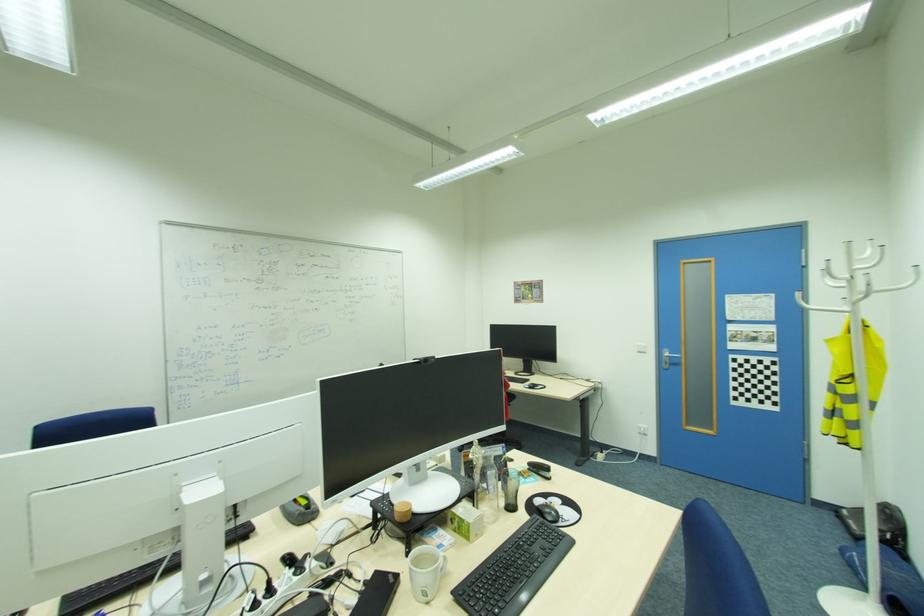
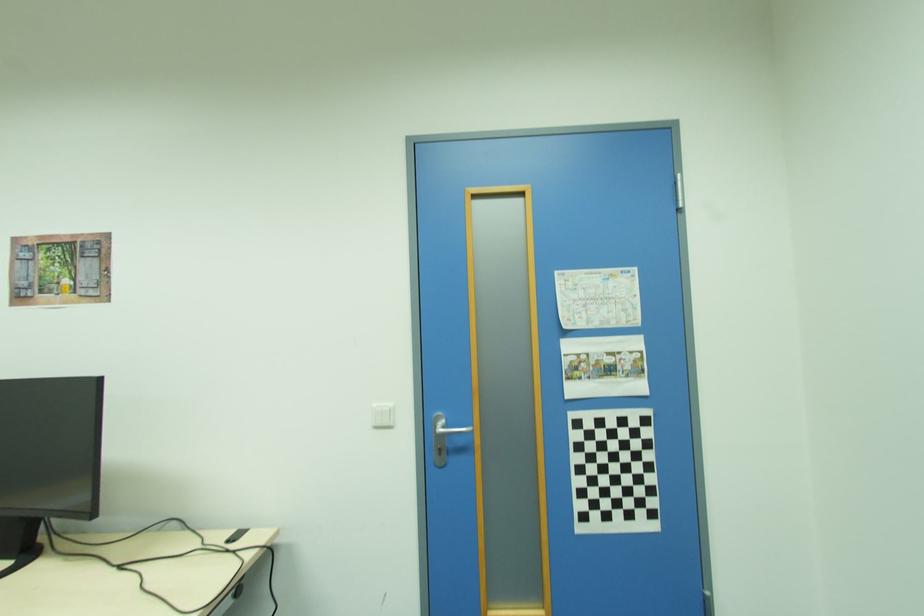
Find the pixel in the second image that matches point (648, 353) in the first image.

(394, 427)